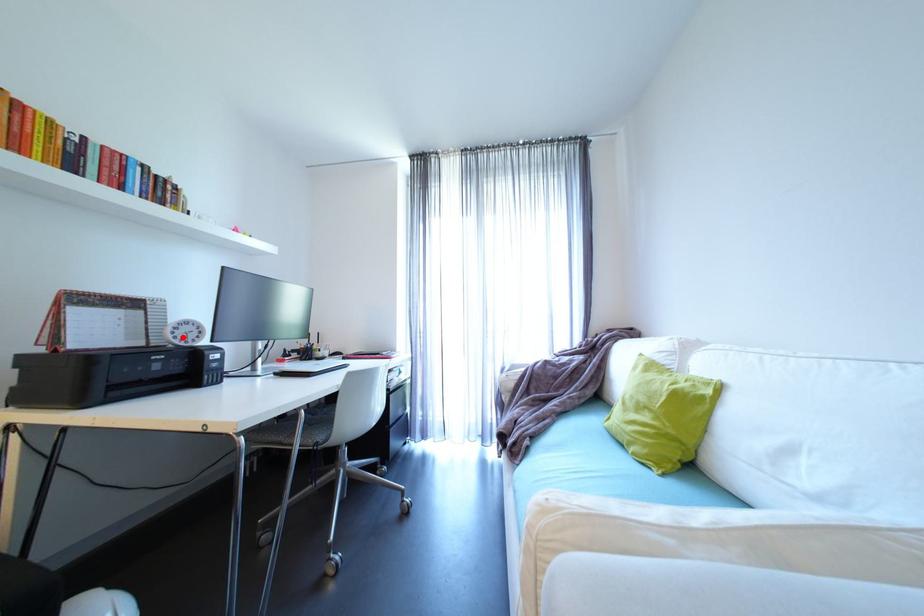
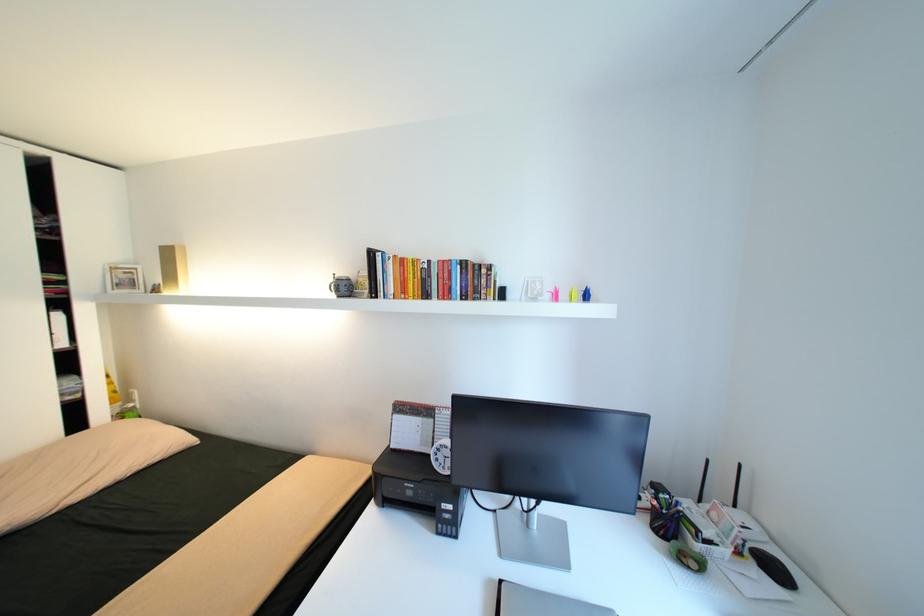
Find the pixel in the second image that matches the highlighted location in the first image.

(444, 460)